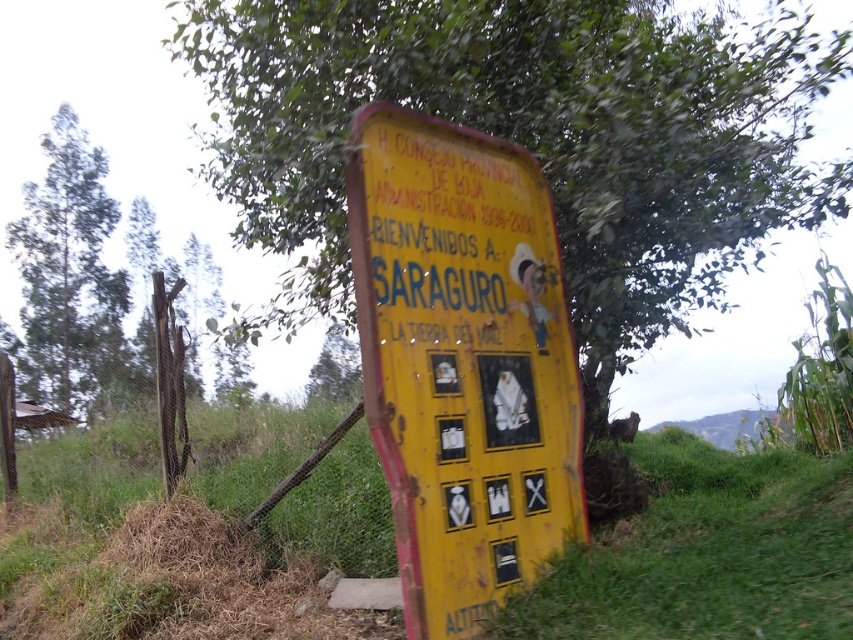
You are a hiker who wants to take a photo of the yellow painted wood sign at center and the green leafy tree at left. If you want the sign to appear larger in the photo than the tree, where should you stand relative to them?

To make the yellow painted wood sign at center appear larger than the green leafy tree at left in the photo, you should stand closer to the yellow painted wood sign at center since it is shorter than the tree. By moving closer to the sign, its image size in the photo will increase relative to the tree.

You are a traveler who has just arrived in Saraguro and see the yellow painted wood sign at center and the green leafy tree at center. According to the sign, where are you now?

The yellow painted wood sign at center indicates that you are in Saraguro, as the sign reads, BIENVENIDOS A SARAGURO LA TIERRA DEL MAIZ, which means Welcome to Saraguro, the Land of Corn.